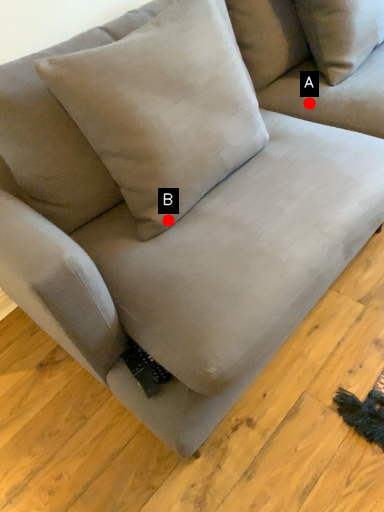
Question: Two points are circled on the image, labeled by A and B beside each circle. Which point is farther from the camera taking this photo?

Choices:
 (A) A is further
 (B) B is further

Answer: (A)